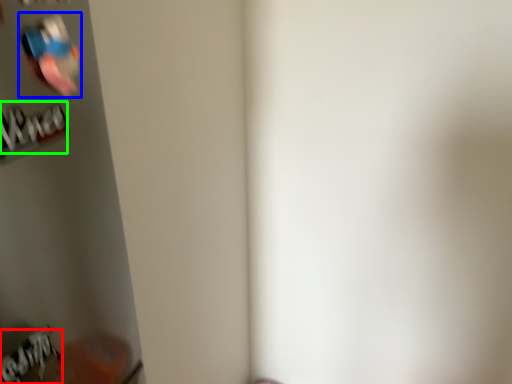
Question: Which object is the farthest from writing (highlighted by a red box)? Choose among these: Wii controller (highlighted by a blue box) or writing (highlighted by a green box).

Choices:
 (A) Wii controller
 (B) writing

Answer: (A)